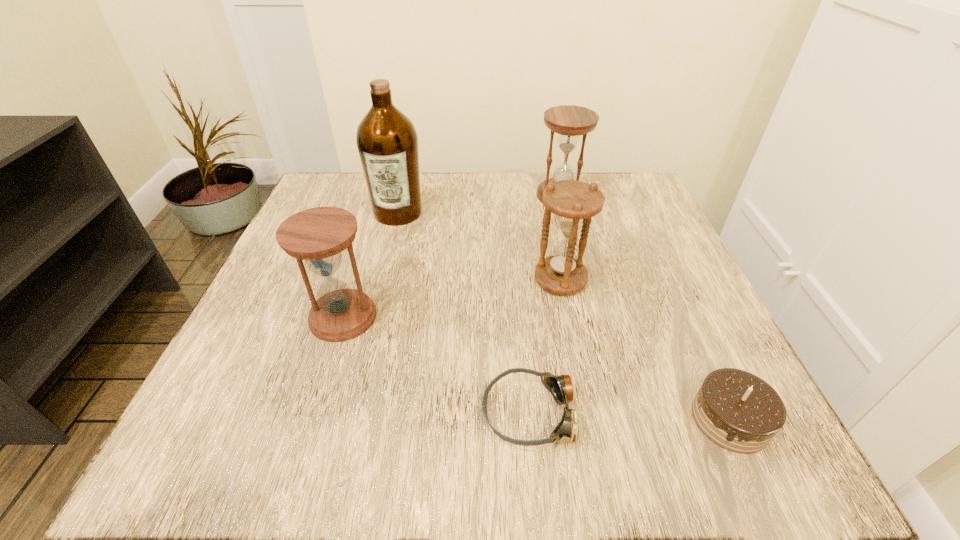
Image resolution: width=960 pixels, height=540 pixels. What are the coordinates of `chocolate cake that is positioned at the right edge` in the screenshot? It's located at (738, 411).

Where is `object at the far left corner`? This screenshot has width=960, height=540. object at the far left corner is located at coordinates (387, 141).

At what (x,y) coordinates should I click in order to perform the action: click on object that is at the far right corner. Please return your answer as a coordinate pair (x, y). This screenshot has height=540, width=960. Looking at the image, I should click on (569, 121).

The image size is (960, 540). I want to click on object that is at the near right corner, so click(738, 411).

The height and width of the screenshot is (540, 960). In the image, there is a desktop. Find the location of `vacant area at the far edge`. vacant area at the far edge is located at coordinates (532, 190).

Identify the location of vacant space at the near edge. (345, 462).

In the image, there is a desktop. Where is `vacant space at the left edge`? Image resolution: width=960 pixels, height=540 pixels. vacant space at the left edge is located at coordinates (345, 260).

Identify the location of free space at the right edge of the desktop. (654, 407).

Locate an element on the screen. Image resolution: width=960 pixels, height=540 pixels. vacant space at the near left corner is located at coordinates (222, 416).

You are a GUI agent. You are given a task and a screenshot of the screen. Output one action in this format:
    pyautogui.click(x=<x>, y=<y>)
    Task: Click on the blank space at the far right corner
    
    Given the screenshot: What is the action you would take?
    pyautogui.click(x=583, y=181)